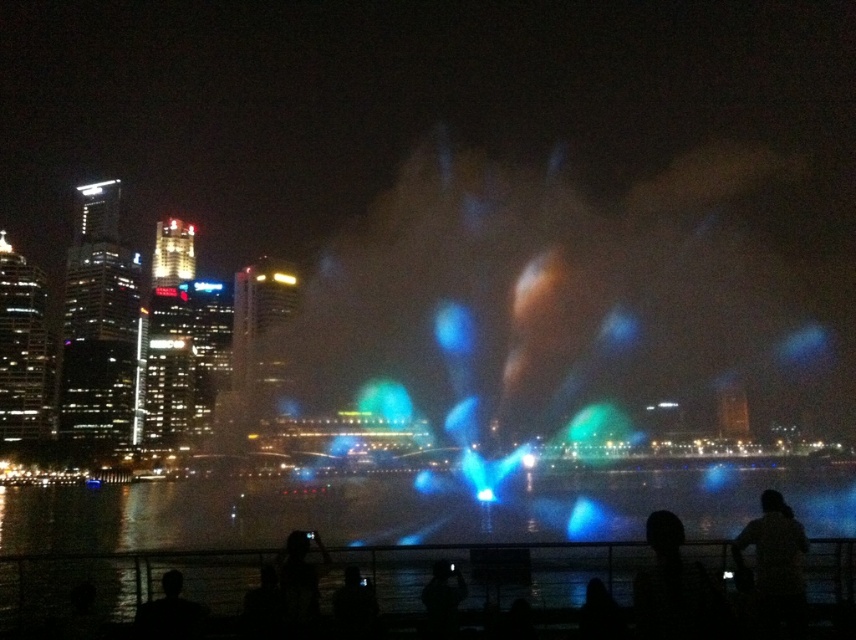
You are a photographer trying to capture the reflection of the colorful lights on the water. You notice two silhouettes in the frame, the silhouette hair at center and the silhouette skin at lower left. Which silhouette is more to the right in the image?

The silhouette hair at center is positioned on the right side of the silhouette skin at lower left, so it is more to the right in the image.

You are a photographer trying to capture the reflection of the colorful lights on the water. You notice two people in the scene, the dark fabric shirt at lower right and the silhouette skin at lower left. Which person is wider from your perspective?

The dark fabric shirt at lower right is wider than the silhouette skin at lower left.